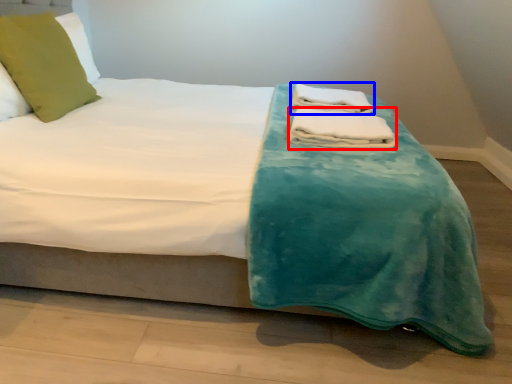
Question: Which object is closer to the camera taking this photo, bath towel (highlighted by a red box) or bath towel (highlighted by a blue box)?

Choices:
 (A) bath towel
 (B) bath towel

Answer: (A)